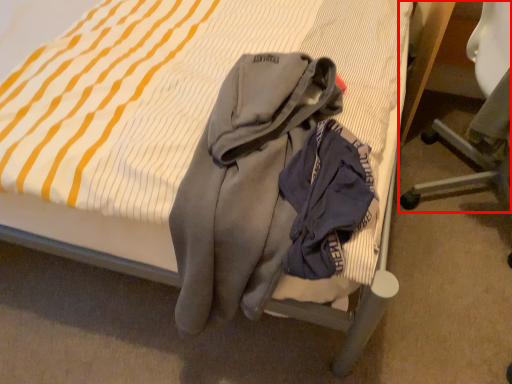
Question: From the image's perspective, what is the correct spatial positioning of chair (annotated by the red box) in reference to garment?

Choices:
 (A) below
 (B) above

Answer: (B)